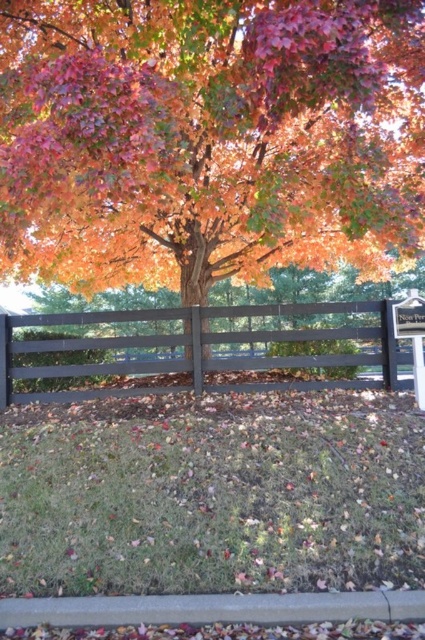
You are standing in an autumn park and see the autumn leaves at center and the smooth dark brown fence at center. Which object is taller?

The autumn leaves at center are much taller than the smooth dark brown fence at center.

You are standing in front of the autumn scene described. You want to place a small decorative rock exactly at the position where the autumn leaves at center are located. What are the coordinates of that location?

The autumn leaves at center are located at coordinates point (207, 138), so you should place the small decorative rock there.

From the picture: You are standing in an autumn scene and want to pick up the autumn leaves at center. The smooth dark brown fence at center is in your way. Can you reach the leaves without crossing the fence?

The autumn leaves at center are closer to the viewer than the smooth dark brown fence at center, so you can reach them without crossing the fence.